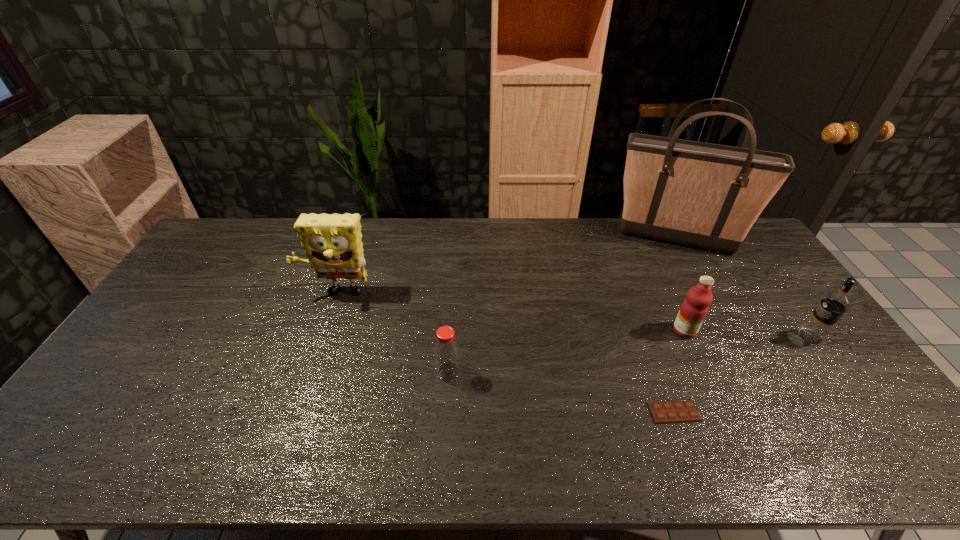
Find the location of a particular element. the farthest object is located at coordinates (707, 196).

Where is `shopping bag`? The width and height of the screenshot is (960, 540). shopping bag is located at coordinates (x=707, y=196).

At what (x,y) coordinates should I click in order to perform the action: click on sponge. Please return your answer as a coordinate pair (x, y). This screenshot has height=540, width=960. Looking at the image, I should click on (332, 242).

At what (x,y) coordinates should I click in order to perform the action: click on the leftmost object. Please return your answer as a coordinate pair (x, y). The width and height of the screenshot is (960, 540). Looking at the image, I should click on (332, 242).

Where is `vodka`? vodka is located at coordinates (835, 303).

Find the location of a particular element. The image size is (960, 540). fruit juice is located at coordinates (694, 308).

Image resolution: width=960 pixels, height=540 pixels. What are the coordinates of `the second object from left to right` in the screenshot? It's located at tap(446, 348).

The width and height of the screenshot is (960, 540). I want to click on bottle, so click(x=446, y=348).

Find the location of a particular element. chocolate bar is located at coordinates (670, 412).

What are the coordinates of `the shortest object` in the screenshot? It's located at (670, 412).